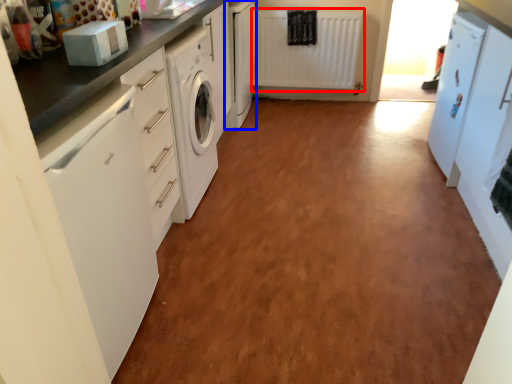
Question: Which point is closer to the camera, radiator (highlighted by a red box) or cabinetry (highlighted by a blue box)?

Choices:
 (A) radiator
 (B) cabinetry

Answer: (B)